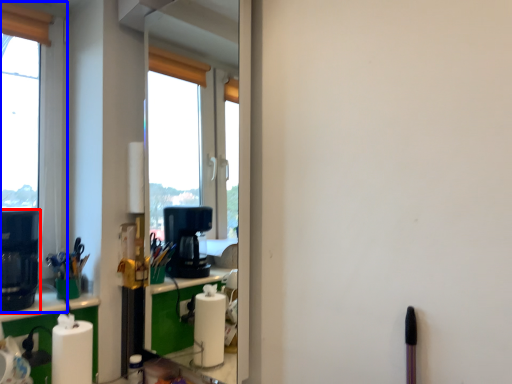
Question: Which of the following is the closest to the observer, coffee machine (highlighted by a red box) or window (highlighted by a blue box)?

Choices:
 (A) coffee machine
 (B) window

Answer: (A)